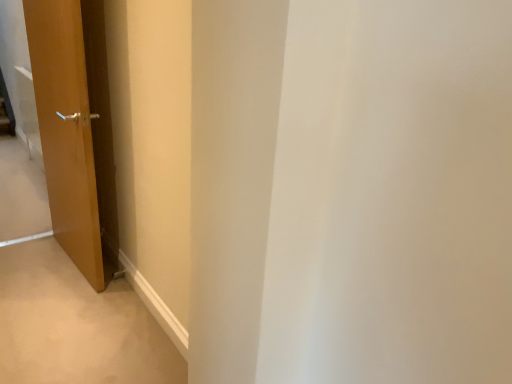
Question: Is matte wood door at left taller or shorter than brown wood door at lower left?

Choices:
 (A) tall
 (B) short

Answer: (A)

Question: Is point (76, 76) closer or farther from the camera than point (129, 324)?

Choices:
 (A) farther
 (B) closer

Answer: (B)

Question: Considering their positions, is matte wood door at left located in front of or behind brown wood door at lower left?

Choices:
 (A) front
 (B) behind

Answer: (B)

Question: Considering the positions of brown wood door at lower left and matte wood door at left in the image, is brown wood door at lower left wider or thinner than matte wood door at left?

Choices:
 (A) wide
 (B) thin

Answer: (A)

Question: Is brown wood door at lower left to the left or to the right of matte wood door at left in the image?

Choices:
 (A) right
 (B) left

Answer: (B)

Question: Based on their sizes in the image, would you say brown wood door at lower left is bigger or smaller than matte wood door at left?

Choices:
 (A) small
 (B) big

Answer: (A)

Question: In the image, is brown wood door at lower left positioned in front of or behind matte wood door at left?

Choices:
 (A) behind
 (B) front

Answer: (B)